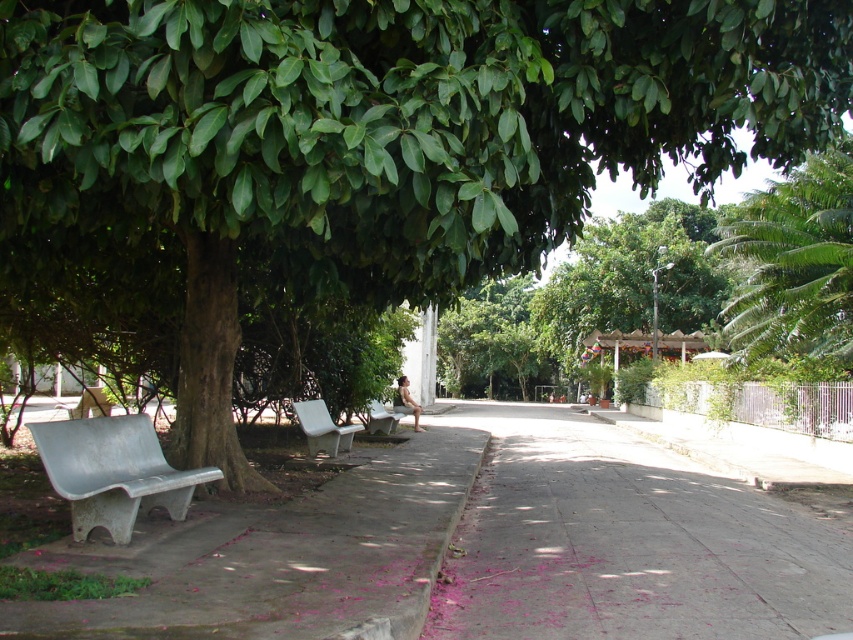
Does white plastic bench at center appear on the left side of metallic silver bench at center?

Indeed, white plastic bench at center is positioned on the left side of metallic silver bench at center.

Who is shorter, white plastic bench at center or metallic silver bench at center?

Standing shorter between the two is metallic silver bench at center.

In order to click on white plastic bench at center in this screenshot , I will do `click(322, 428)`.

Locate an element on the screen. The width and height of the screenshot is (853, 640). white plastic bench at center is located at coordinates tap(322, 428).

Between point (181, 500) and point (397, 420), which one is positioned behind?

Point (397, 420)

Between metallic gray bench at left and metallic silver bench at center, which one is positioned higher?

metallic gray bench at left is above.

Is point (117, 513) behind point (375, 429)?

No, it is not.

Find the location of a particular element. Image resolution: width=853 pixels, height=640 pixels. metallic gray bench at left is located at coordinates (113, 472).

Who is shorter, metallic gray bench at left or white plastic bench at center?

white plastic bench at center

Who is more forward, (132, 508) or (309, 452)?

Point (132, 508) is in front.

Which is in front, point (48, 465) or point (315, 435)?

Point (48, 465) is more forward.

Locate an element on the screen. metallic gray bench at left is located at coordinates (113, 472).